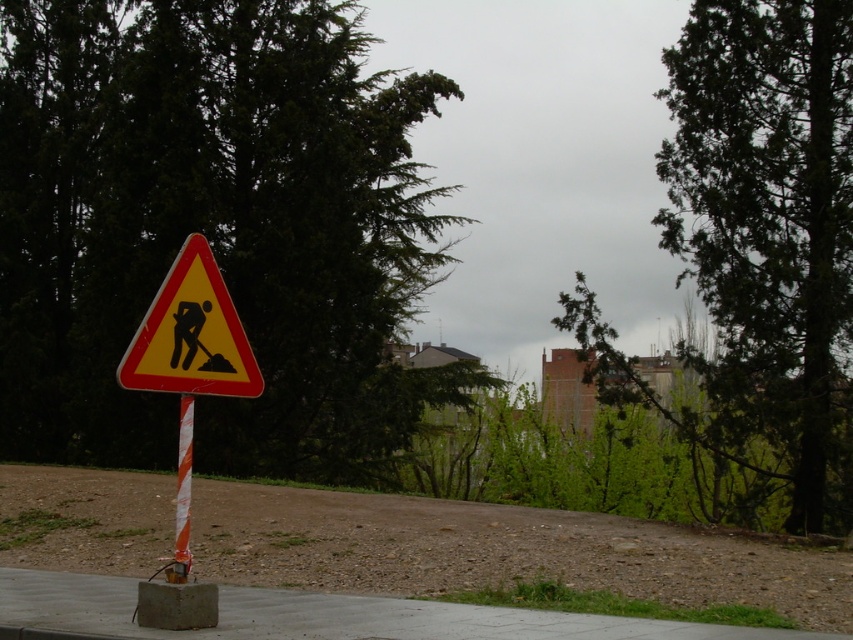
Question: Is concrete at center below orange striped pole at center?

Choices:
 (A) yes
 (B) no

Answer: (A)

Question: Based on their relative distances, which object is nearer to the concrete at center?

Choices:
 (A) green leafy tree at upper right
 (B) yellow reflective triangle at center
 (C) green leafy tree at center
 (D) orange striped pole at center

Answer: (D)

Question: Which object is the farthest from the orange striped pole at center?

Choices:
 (A) green leafy tree at center
 (B) yellow reflective triangle at center

Answer: (A)

Question: Which of these objects is positioned farthest from the orange striped pole at center?

Choices:
 (A) yellow reflective triangle at center
 (B) concrete at center

Answer: (B)

Question: Considering the relative positions of green leafy tree at upper right and orange striped pole at center in the image provided, where is green leafy tree at upper right located with respect to orange striped pole at center?

Choices:
 (A) right
 (B) left

Answer: (A)

Question: Can you confirm if concrete at center is positioned above orange striped pole at center?

Choices:
 (A) no
 (B) yes

Answer: (A)